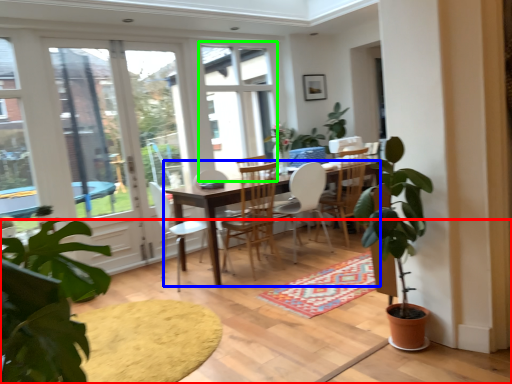
Question: Which object is positioned closest to carpeting (highlighted by a red box)? Select from desk (highlighted by a blue box) and window (highlighted by a green box).

Choices:
 (A) desk
 (B) window

Answer: (A)